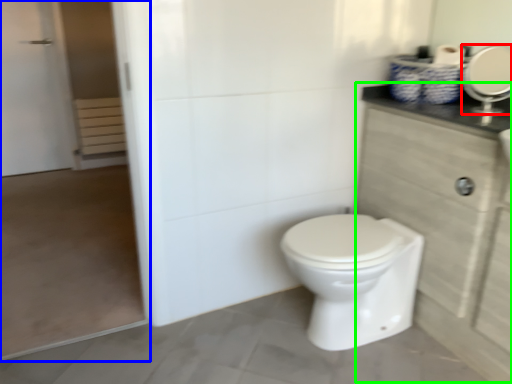
Question: Which object is the closest to the mirror (highlighted by a red box)? Choose among these: screen door (highlighted by a blue box) or dresser (highlighted by a green box).

Choices:
 (A) screen door
 (B) dresser

Answer: (B)